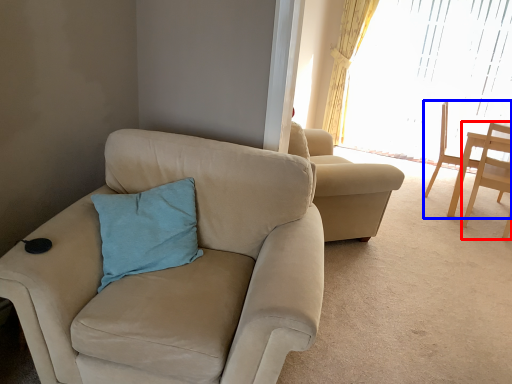
Question: Which point is further to the camera, chair (highlighted by a red box) or chair (highlighted by a blue box)?

Choices:
 (A) chair
 (B) chair

Answer: (B)